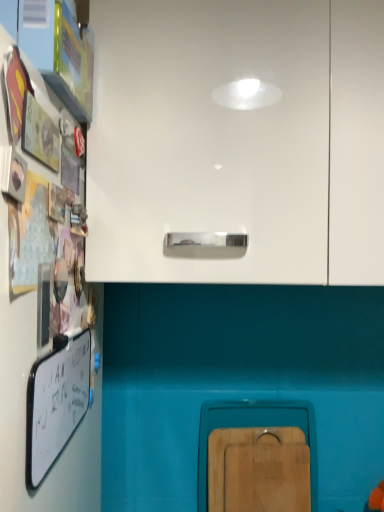
Question: Are wooden cutting board at lower center, arranged as the 1th cabinetry when ordered from the bottom, and white glossy cabinet at upper center, marked as the 2th cabinetry in a bottom-to-top arrangement, making contact?

Choices:
 (A) yes
 (B) no

Answer: (B)

Question: Does wooden cutting board at lower center, positioned as the second cabinetry in front-to-back order, have a lesser height compared to white glossy cabinet at upper center, acting as the 1th cabinetry starting from the top?

Choices:
 (A) no
 (B) yes

Answer: (B)

Question: Is white glossy cabinet at upper center, which is counted as the second cabinetry, starting from the back, located within wooden cutting board at lower center, positioned as the second cabinetry in front-to-back order?

Choices:
 (A) no
 (B) yes

Answer: (A)

Question: From a real-world perspective, is wooden cutting board at lower center, positioned as the second cabinetry in front-to-back order, positioned over white glossy cabinet at upper center, which is counted as the second cabinetry, starting from the back, based on gravity?

Choices:
 (A) yes
 (B) no

Answer: (B)

Question: Does wooden cutting board at lower center, arranged as the 2th cabinetry when viewed from the top, come in front of white glossy cabinet at upper center, arranged as the first cabinetry when viewed from the front?

Choices:
 (A) yes
 (B) no

Answer: (B)

Question: Is whiteboard at left taller or shorter than white glossy cabinet at upper center, arranged as the first cabinetry when viewed from the front?

Choices:
 (A) short
 (B) tall

Answer: (A)

Question: From a real-world perspective, is whiteboard at left above or below white glossy cabinet at upper center, arranged as the first cabinetry when viewed from the front?

Choices:
 (A) below
 (B) above

Answer: (A)

Question: From the image's perspective, is whiteboard at left located above or below white glossy cabinet at upper center, acting as the 1th cabinetry starting from the top?

Choices:
 (A) above
 (B) below

Answer: (B)

Question: Is whiteboard at left inside the boundaries of white glossy cabinet at upper center, marked as the 2th cabinetry in a bottom-to-top arrangement, or outside?

Choices:
 (A) outside
 (B) inside

Answer: (A)

Question: From the image's perspective, is wooden cutting board at lower center, arranged as the 2th cabinetry when viewed from the top, located above or below whiteboard at left?

Choices:
 (A) below
 (B) above

Answer: (A)

Question: In terms of size, does wooden cutting board at lower center, positioned as the second cabinetry in front-to-back order, appear bigger or smaller than whiteboard at left?

Choices:
 (A) small
 (B) big

Answer: (B)

Question: Considering the positions of point (309, 415) and point (66, 421), is point (309, 415) closer or farther from the camera than point (66, 421)?

Choices:
 (A) closer
 (B) farther

Answer: (B)

Question: In terms of height, does wooden cutting board at lower center, arranged as the 1th cabinetry when ordered from the bottom, look taller or shorter compared to whiteboard at left?

Choices:
 (A) tall
 (B) short

Answer: (A)

Question: Based on their positions, is white glossy cabinet at upper center, which is counted as the second cabinetry, starting from the back, located to the left or right of whiteboard at left?

Choices:
 (A) left
 (B) right

Answer: (B)

Question: From a real-world perspective, is white glossy cabinet at upper center, arranged as the first cabinetry when viewed from the front, physically located above or below whiteboard at left?

Choices:
 (A) below
 (B) above

Answer: (B)